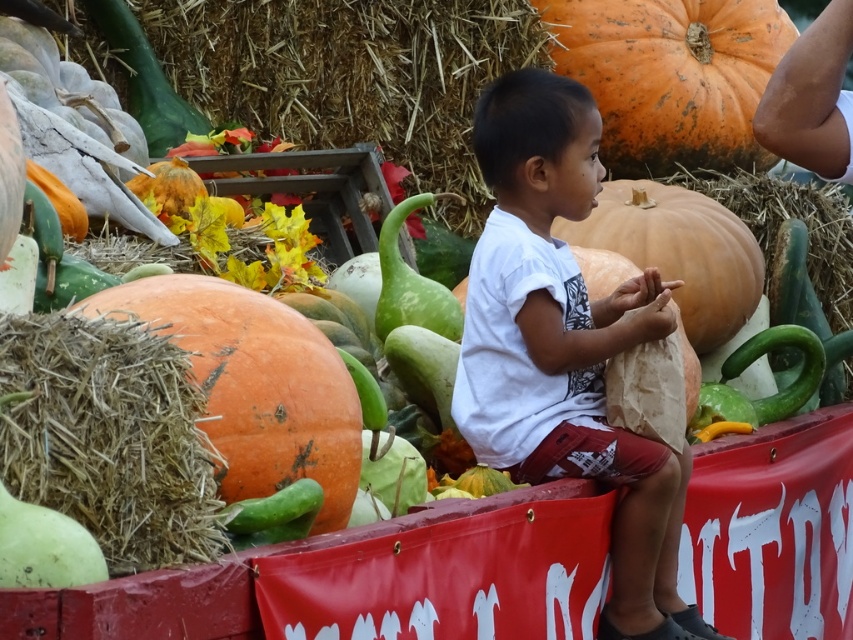
In the autumn scene, there is a child wearing a white cotton shirt at center and holding an orange matte pumpkin at left. Which object is positioned more to the right?

The white cotton shirt at center is positioned to the right of the orange matte pumpkin at left.

You are standing at the pumpkin patch and see two points marked in the scene. The first point is at coordinate point (282, 385) and the second is at point (631, 109). Which point is closer to you?

Point (282, 385) is in front of point (631, 109), so it is closer to you.